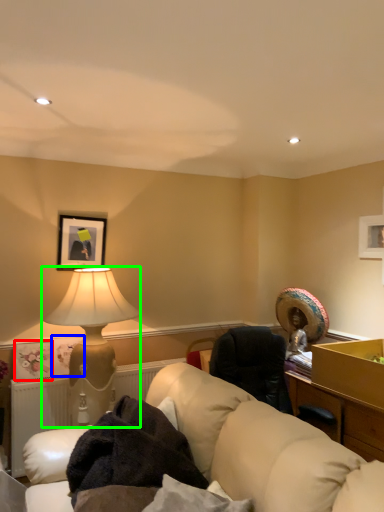
Question: Based on their relative distances, which object is nearer to picture frame (highlighted by a red box)? Choose from picture frame (highlighted by a blue box) and lamp (highlighted by a green box).

Choices:
 (A) picture frame
 (B) lamp

Answer: (A)